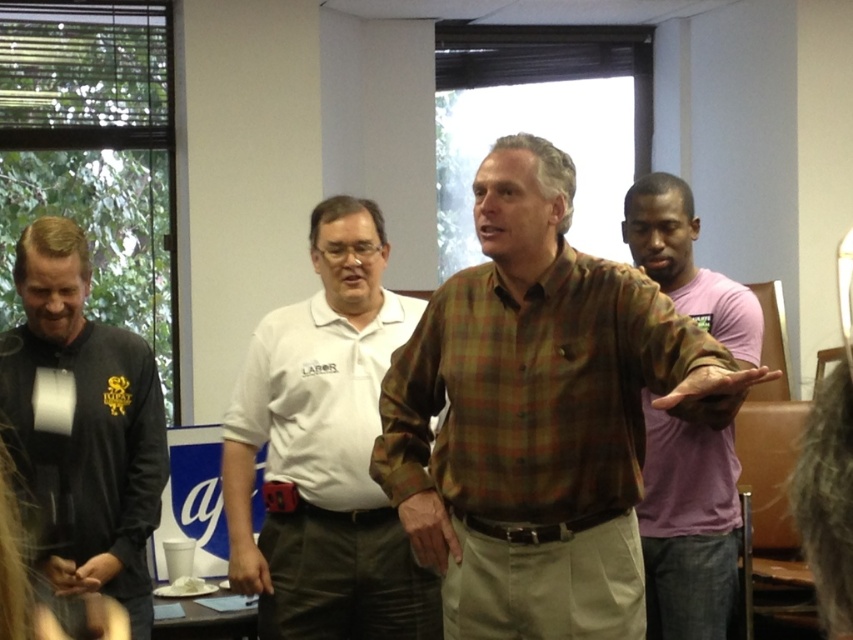
Looking at this image, you are organizing a charity event and need to decide which of the two shirts, the white cotton shirt at center or the black matte polo shirt at left, would be more suitable for a display stand that requires a larger shirt to catch attention. Based on the scene description, which shirt should you choose?

The white cotton shirt at center is larger in size than the black matte polo shirt at left, so the white cotton shirt at center would be more suitable for the display stand as it is bigger and can catch more attention.

You are standing at the entrance of the conference room and want to approach the person wearing the white cotton shirt at center. According to the coordinates provided, in which direction should you move from your current position to reach them?

The white cotton shirt at center is located at coordinates point (323, 451), so you should move towards the center of the room to reach them.